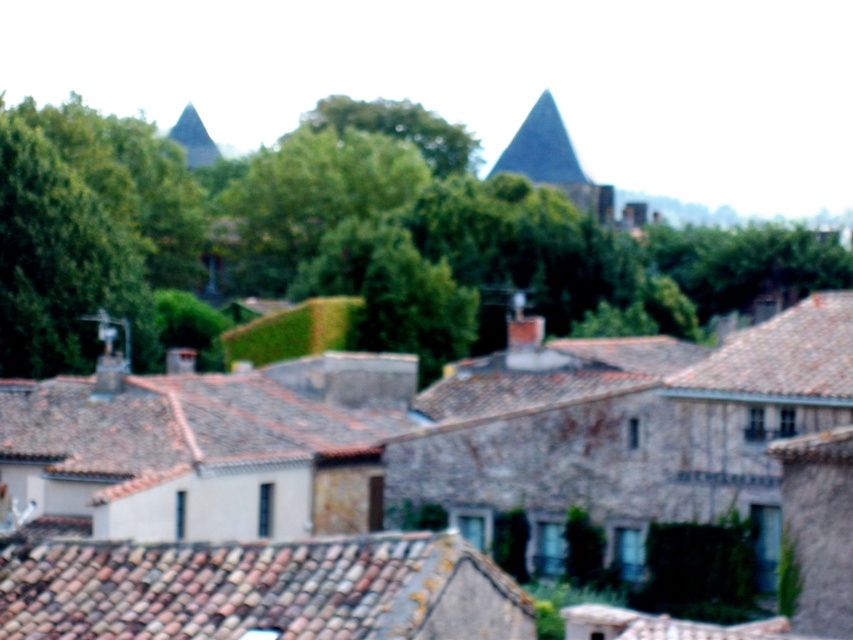
You are standing at the point with coordinates (263, 589) in the village. What is the color of the roof located at that point?

The brown tile roof at lower center is located at point (263, 589), so the color is brown.

You are an architect analyzing the village layout. Which roof has a smaller width between the brown tile roof at upper right and the dark gray stone roof at upper center?

The brown tile roof at upper right has a lesser width compared to the dark gray stone roof at upper center.

In the scene shown: You are a tourist in the village and want to take a photo that includes both the brown tile roof at lower center and the brown tile roof at upper right. Which roof should you position closer to the center of your camera frame to ensure both are visible?

Position the brown tile roof at lower center closer to the center of your camera frame because it is wider than the brown tile roof at upper right, making it easier to include both in the frame.